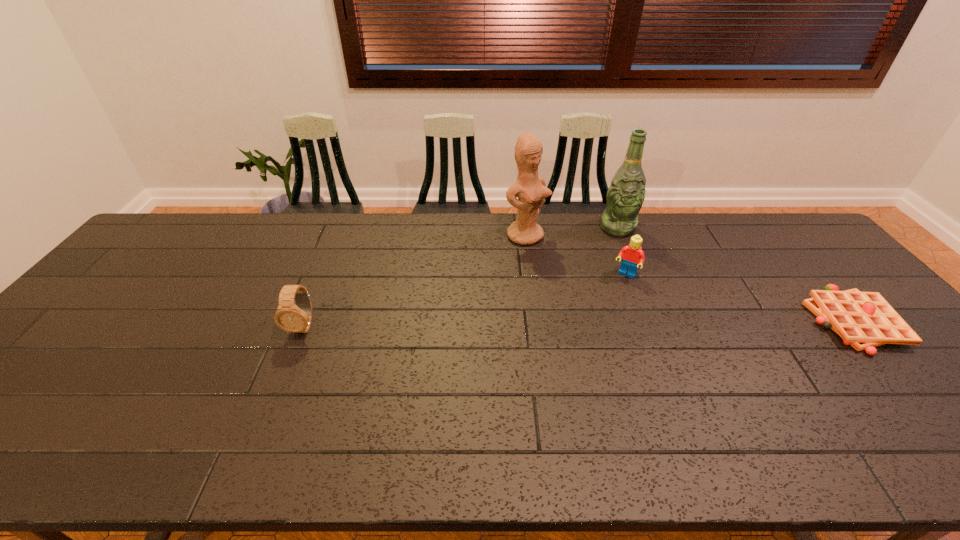
The height and width of the screenshot is (540, 960). What are the coordinates of `vacant space on the desktop that is between the watch and the waffle and is positioned on the face of the Lego` in the screenshot? It's located at (600, 323).

Image resolution: width=960 pixels, height=540 pixels. What are the coordinates of `vacant space on the desktop that is between the leftmost object and the waffle and is positioned on the front-facing side of the figurine` in the screenshot? It's located at (636, 323).

The height and width of the screenshot is (540, 960). I want to click on free space on the desktop that is between the watch and the shortest object and is positioned on the surface of the beer bottle, so click(633, 323).